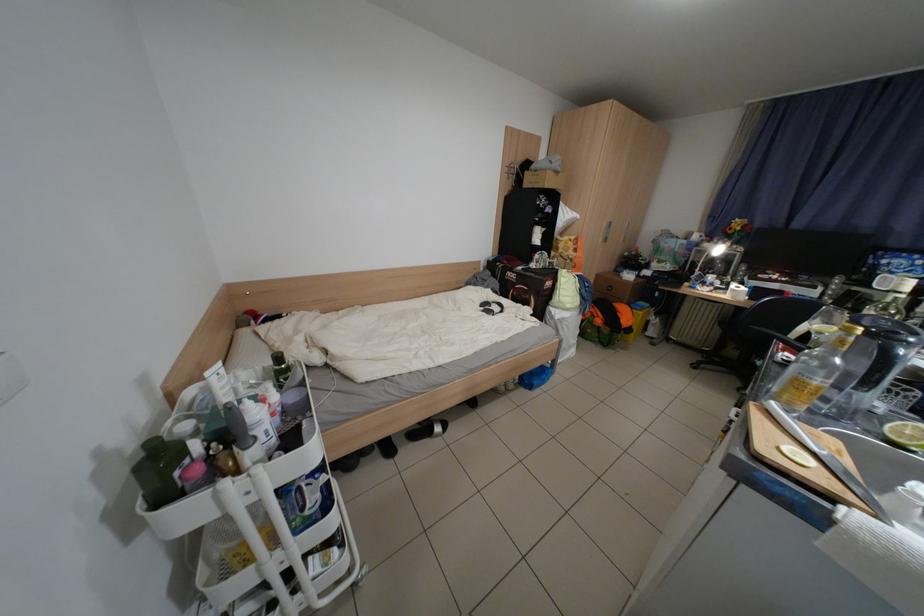
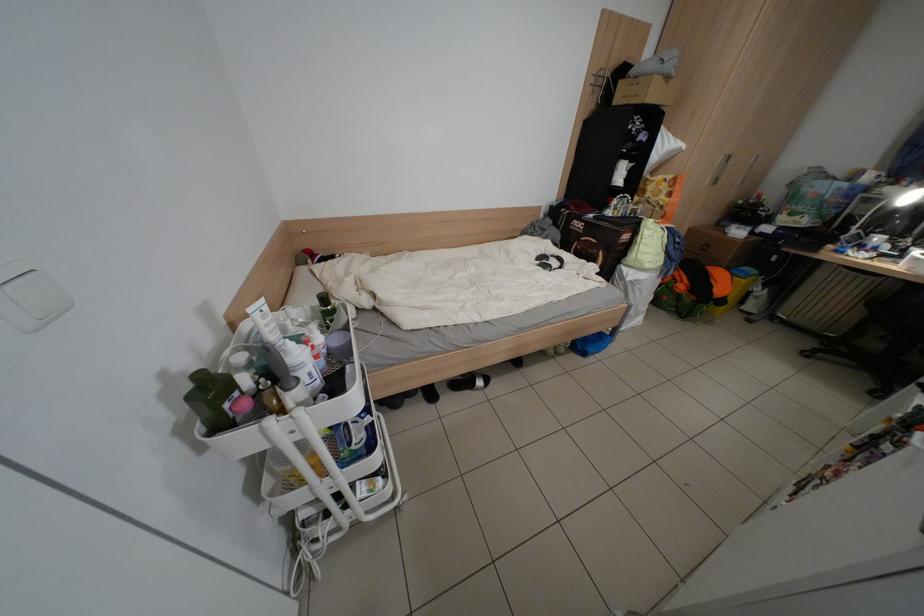
In the second image, find the point that corresponds to (x=493, y=310) in the first image.

(550, 264)